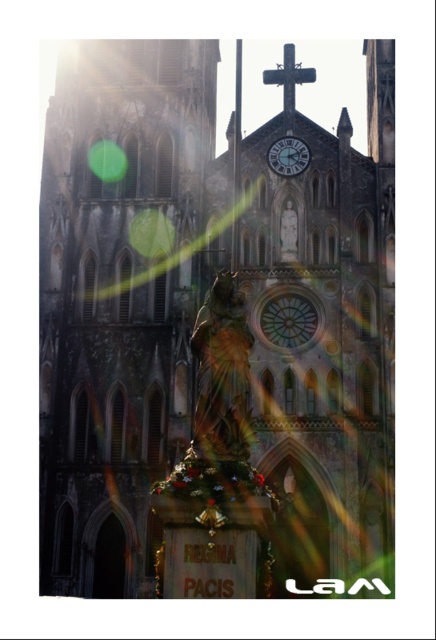
Question: Is the position of gold polished statue at center less distant than that of dark gray metallic cross at upper center?

Choices:
 (A) no
 (B) yes

Answer: (B)

Question: Does gold polished statue at center appear under matte black clock at center?

Choices:
 (A) no
 (B) yes

Answer: (B)

Question: Among these objects, which one is farthest from the camera?

Choices:
 (A) matte black clock at center
 (B) stone church at center
 (C) dark gray metallic cross at upper center
 (D) gold polished statue at center

Answer: (C)

Question: Can you confirm if dark gray metallic cross at upper center is thinner than matte black clock at center?

Choices:
 (A) yes
 (B) no

Answer: (B)

Question: Which point is farther to the camera?

Choices:
 (A) (228, 422)
 (B) (280, 166)
 (C) (64, 324)
 (D) (286, 106)

Answer: (D)

Question: Based on their relative distances, which object is farther from the gold polished statue at center?

Choices:
 (A) matte black clock at center
 (B) stone church at center
 (C) dark gray metallic cross at upper center

Answer: (C)